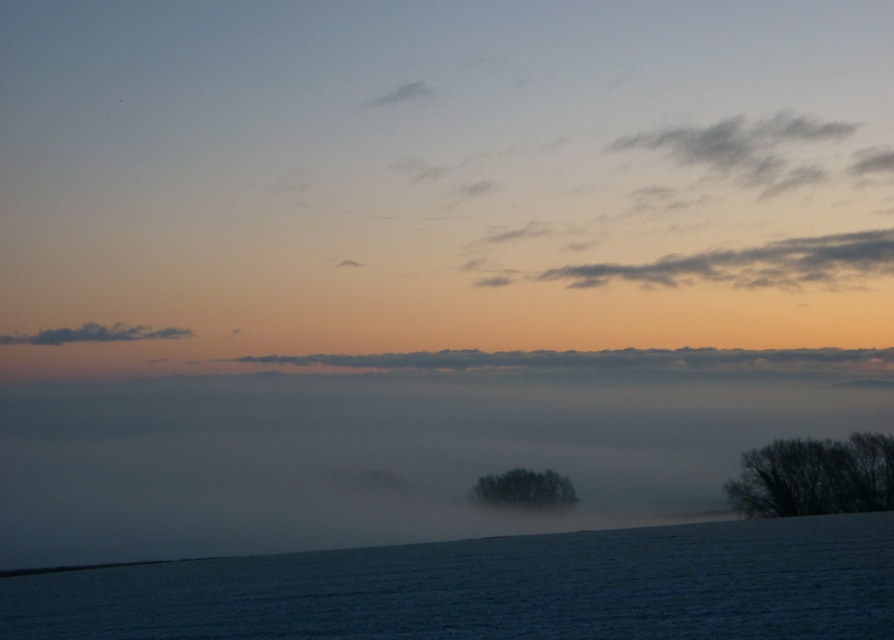
Question: Is green matte tree at center behind white fluffy cloud at upper center?

Choices:
 (A) yes
 (B) no

Answer: (B)

Question: Does dark brown textured tree at right have a larger size compared to white fluffy cloud at upper center?

Choices:
 (A) no
 (B) yes

Answer: (B)

Question: Which point is farther to the camera?

Choices:
 (A) white frosty field at lower center
 (B) green matte tree at center
 (C) dark gray fluffy cloud at left

Answer: (C)

Question: Which object appears closest to the camera in this image?

Choices:
 (A) green matte tree at center
 (B) dark gray fluffy cloud at left
 (C) gray fluffy cloud at upper right

Answer: (A)

Question: Among these points, which one is nearest to the camera?

Choices:
 (A) (841, 358)
 (B) (545, 500)

Answer: (B)

Question: Does foggy mist at center come behind dark gray fluffy cloud at left?

Choices:
 (A) no
 (B) yes

Answer: (A)